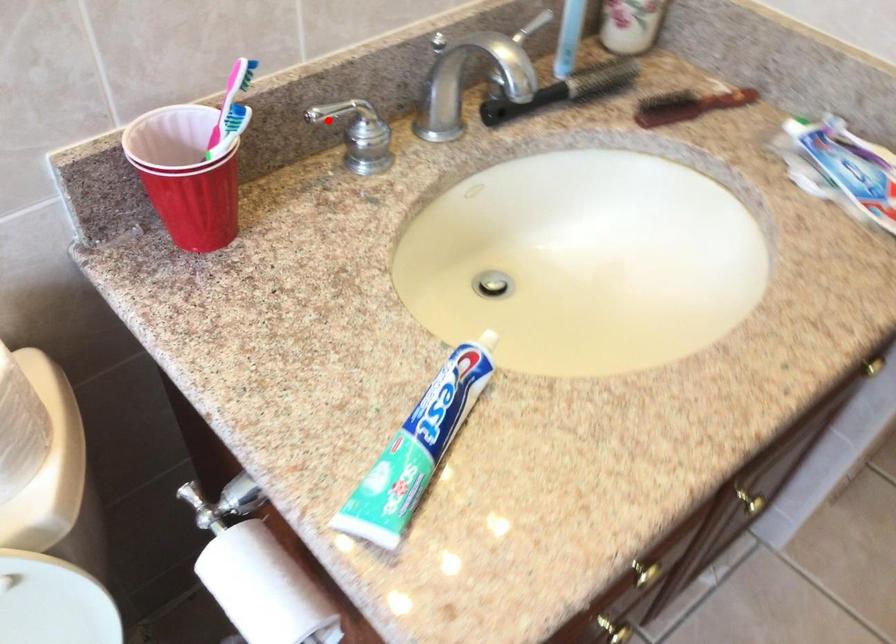
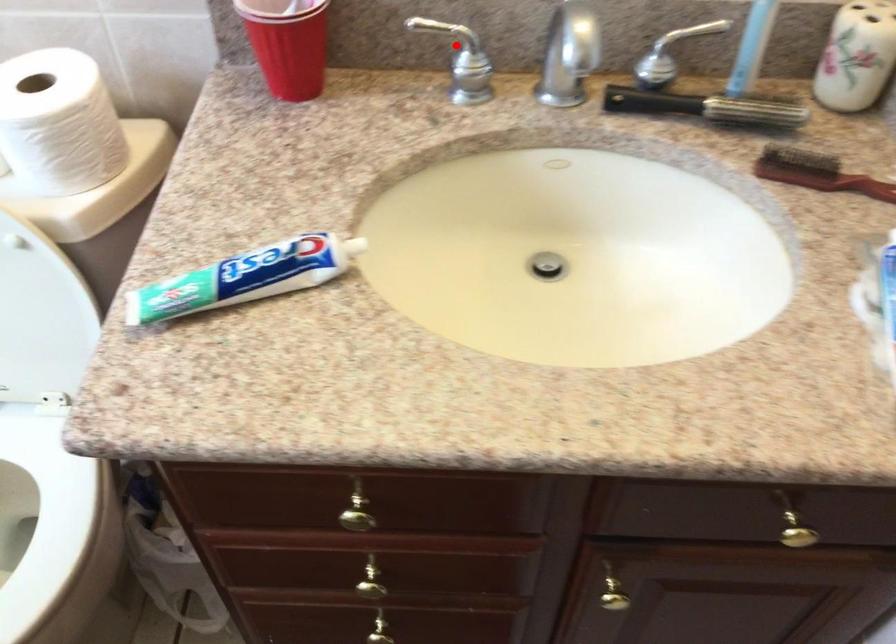
I am providing you with two images of the same scene from different viewpoints. A red point is marked on the first image and another point is marked on the second image. Does the point marked in image1 correspond to the same location as the one in image2?

Yes